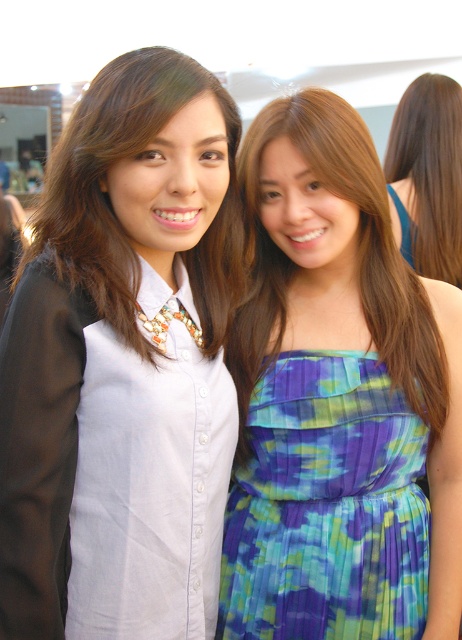
Question: Which of these objects is positioned closest to the white glossy shirt at center?

Choices:
 (A) blue-green pleated dress at center
 (B) blue tie-dye dress at center

Answer: (B)

Question: Which object is positioned closest to the blue tie-dye dress at center?

Choices:
 (A) blue-green pleated dress at center
 (B) brown hair at upper right

Answer: (A)

Question: Which object is positioned closest to the white glossy shirt at center?

Choices:
 (A) blue tie-dye dress at center
 (B) blue-green pleated dress at center
 (C) brown hair at upper right

Answer: (A)

Question: Can you confirm if blue-green pleated dress at center is positioned below brown hair at upper right?

Choices:
 (A) no
 (B) yes

Answer: (B)

Question: In this image, where is blue-green pleated dress at center located relative to brown hair at upper right?

Choices:
 (A) left
 (B) right

Answer: (A)

Question: From the image, what is the correct spatial relationship of white glossy shirt at center in relation to blue tie-dye dress at center?

Choices:
 (A) below
 (B) above

Answer: (B)